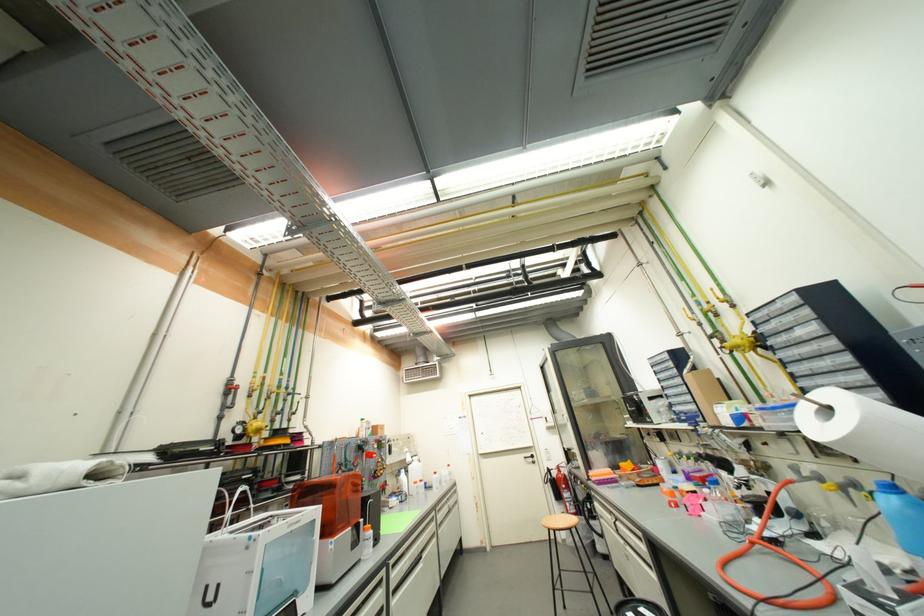
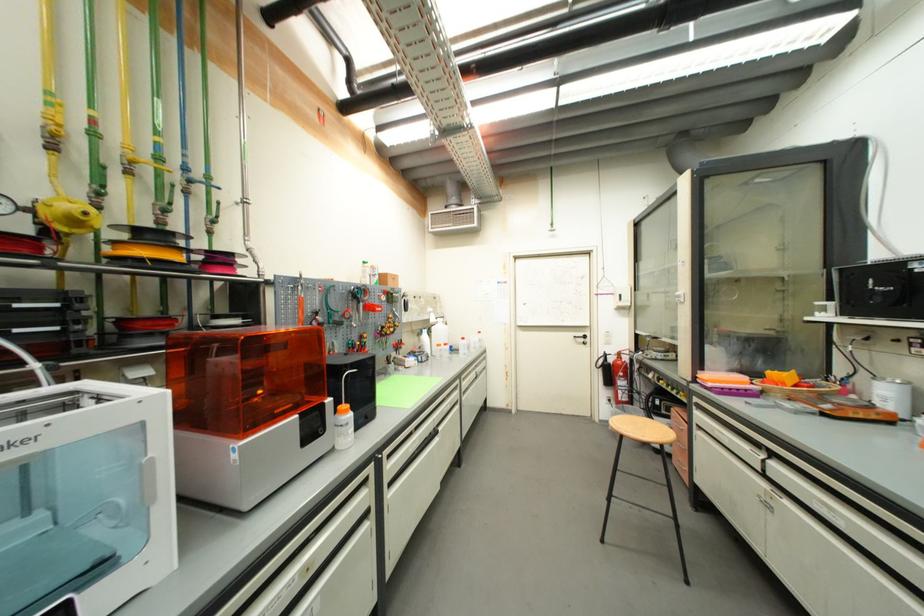
Where in the second image is the point corresponding to point (261, 379) from the first image?

(55, 106)